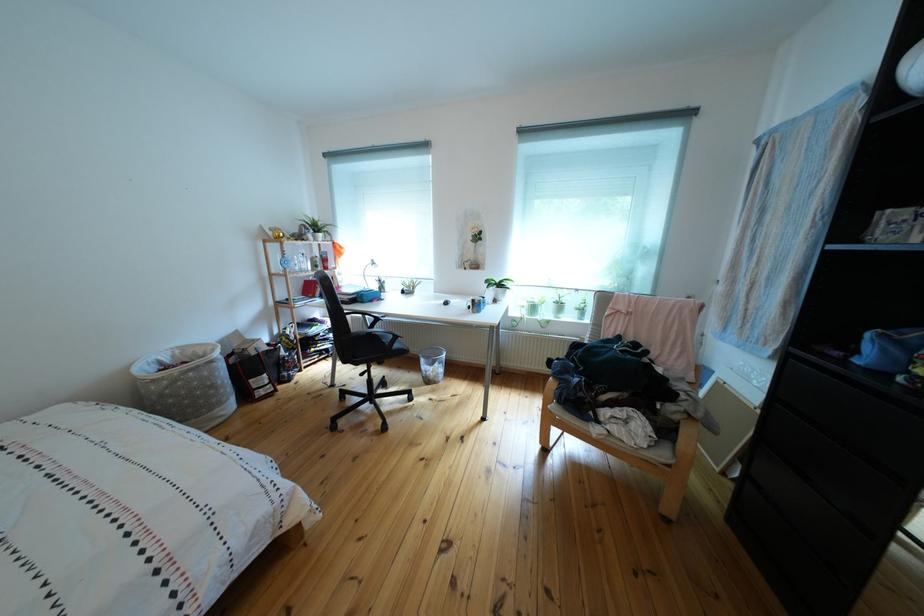
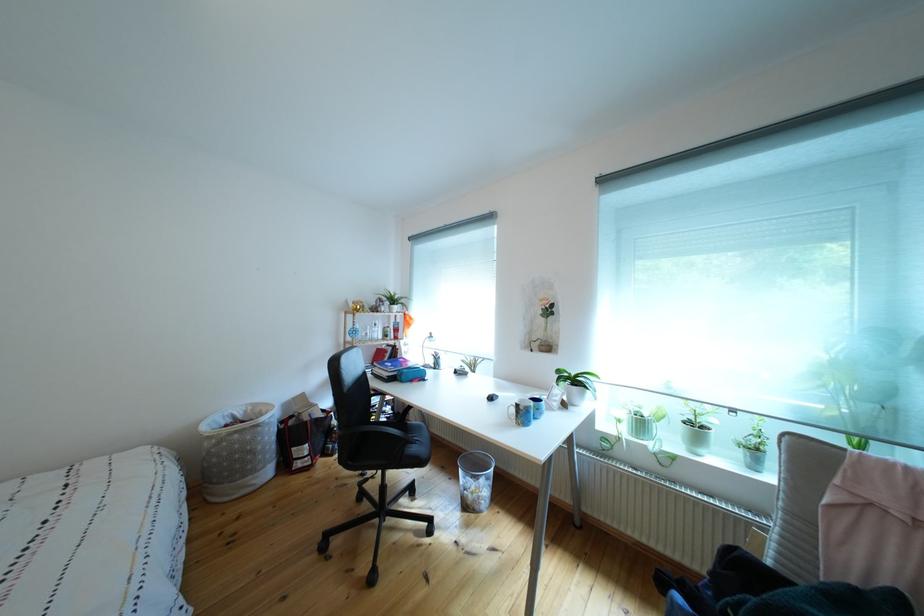
The point at [224,392] is marked in the first image. Where is the corresponding point in the second image?

(263, 456)